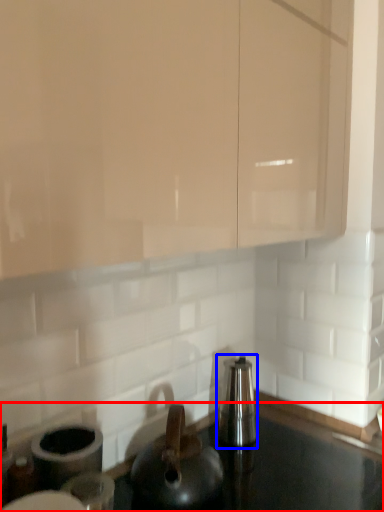
Question: Among these objects, which one is nearest to the camera, countertop (highlighted by a red box) or appliance (highlighted by a blue box)?

Choices:
 (A) countertop
 (B) appliance

Answer: (A)